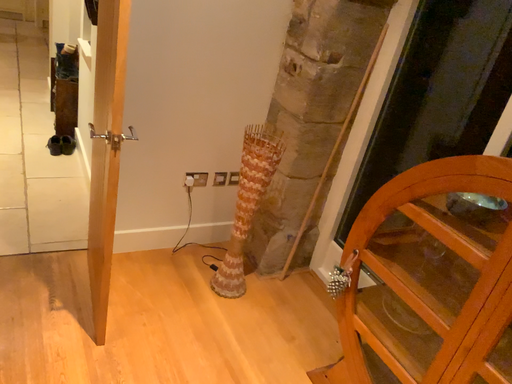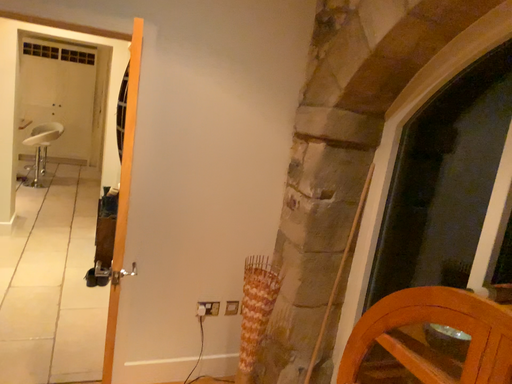
Question: How did the camera likely rotate when shooting the video?

Choices:
 (A) rotated upward
 (B) rotated downward

Answer: (A)